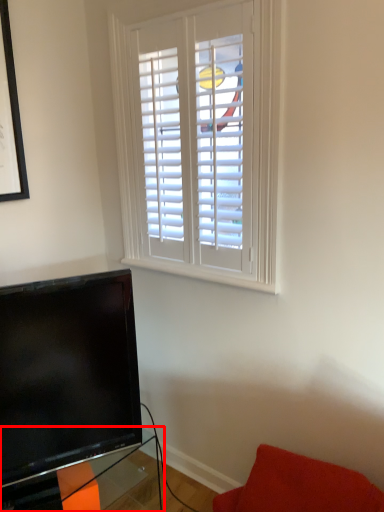
Question: Observing the image, what is the correct spatial positioning of table (annotated by the red box) in reference to furniture?

Choices:
 (A) left
 (B) right

Answer: (A)